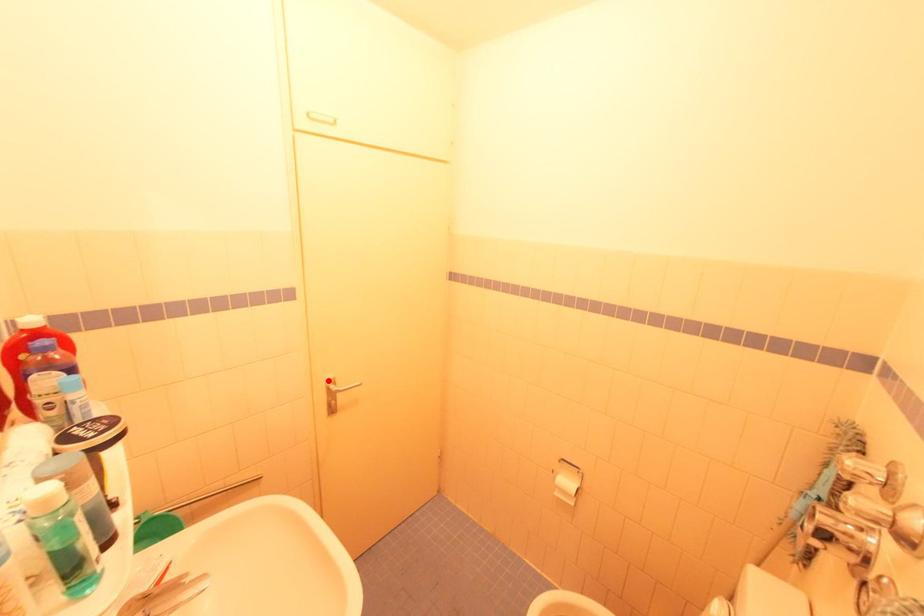
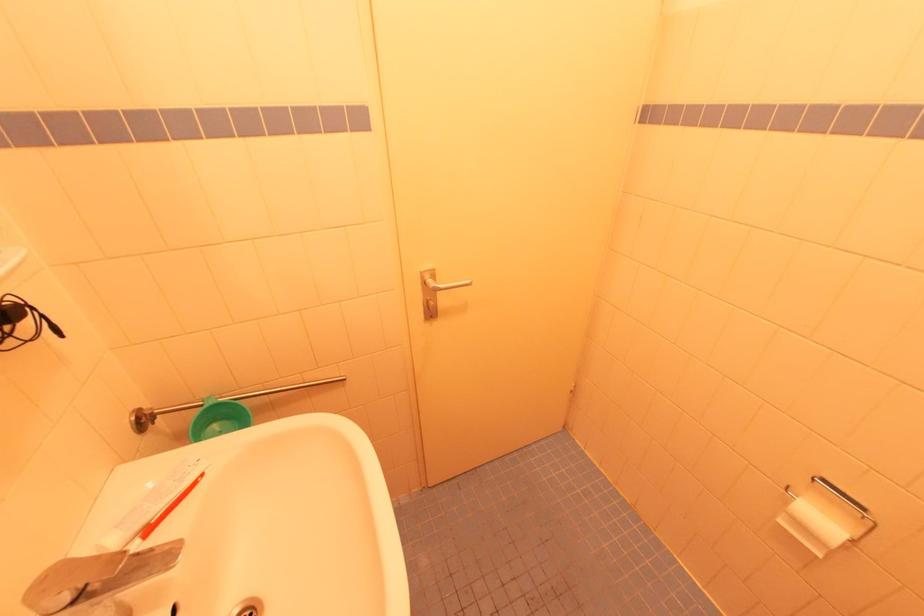
In the second image, find the point that corresponds to the highlighted location in the first image.

(423, 272)